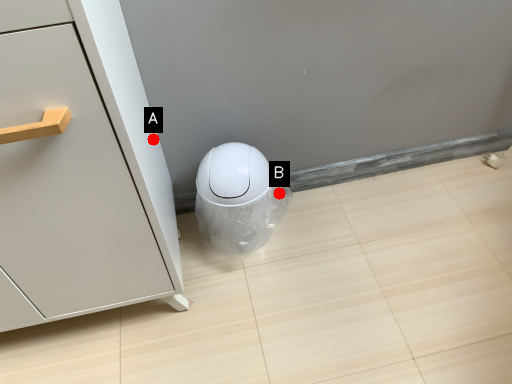
Question: Two points are circled on the image, labeled by A and B beside each circle. Which point is closer to the camera?

Choices:
 (A) A is closer
 (B) B is closer

Answer: (A)